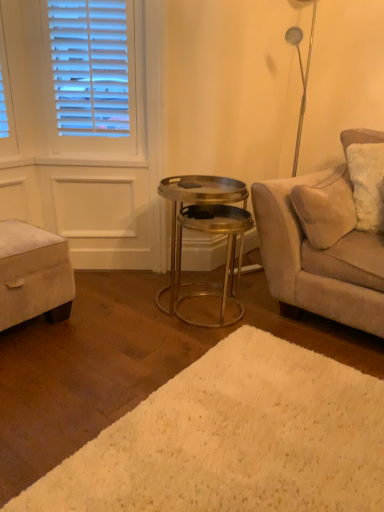
Question: From the image's perspective, does white shag rug at lower center appear higher than velvet beige ottoman at lower left?

Choices:
 (A) no
 (B) yes

Answer: (A)

Question: Can you confirm if white shag rug at lower center is shorter than velvet beige ottoman at lower left?

Choices:
 (A) yes
 (B) no

Answer: (A)

Question: Is white shag rug at lower center wider than velvet beige ottoman at lower left?

Choices:
 (A) no
 (B) yes

Answer: (B)

Question: Can you confirm if white shag rug at lower center is positioned to the right of velvet beige ottoman at lower left?

Choices:
 (A) yes
 (B) no

Answer: (A)

Question: Is white shag rug at lower center further to the viewer compared to velvet beige ottoman at lower left?

Choices:
 (A) yes
 (B) no

Answer: (B)

Question: In the image, is suede beige couch at right positioned in front of or behind metallic/golden table at center?

Choices:
 (A) front
 (B) behind

Answer: (A)

Question: Considering the positions of point (258, 185) and point (220, 310), is point (258, 185) closer or farther from the camera than point (220, 310)?

Choices:
 (A) closer
 (B) farther

Answer: (A)

Question: Is suede beige couch at right bigger or smaller than metallic/golden table at center?

Choices:
 (A) small
 (B) big

Answer: (B)

Question: Choose the correct answer: Is suede beige couch at right inside metallic/golden table at center or outside it?

Choices:
 (A) inside
 (B) outside

Answer: (B)

Question: Is metallic/golden table at center situated inside white shag rug at lower center or outside?

Choices:
 (A) inside
 (B) outside

Answer: (B)

Question: In terms of width, does metallic/golden table at center look wider or thinner when compared to white shag rug at lower center?

Choices:
 (A) thin
 (B) wide

Answer: (A)

Question: Considering the positions of point (177, 278) and point (233, 480), is point (177, 278) closer or farther from the camera than point (233, 480)?

Choices:
 (A) farther
 (B) closer

Answer: (A)

Question: Considering the positions of metallic/golden table at center and white shag rug at lower center in the image, is metallic/golden table at center taller or shorter than white shag rug at lower center?

Choices:
 (A) short
 (B) tall

Answer: (B)

Question: Is point (210, 488) positioned closer to the camera than point (334, 289)?

Choices:
 (A) closer
 (B) farther

Answer: (A)

Question: From the image's perspective, is white shag rug at lower center located above or below suede beige couch at right?

Choices:
 (A) below
 (B) above

Answer: (A)